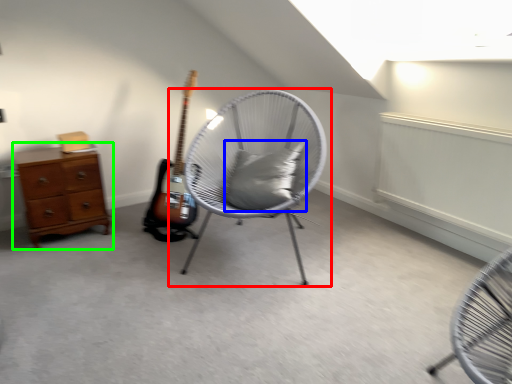
Question: Which is nearer to the chair (highlighted by a red box)? pillow (highlighted by a blue box) or chest of drawers (highlighted by a green box).

Choices:
 (A) pillow
 (B) chest of drawers

Answer: (A)